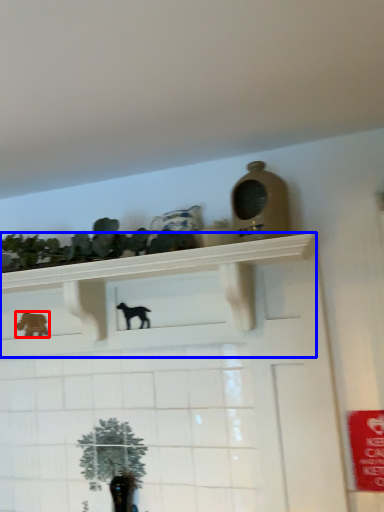
Question: Which object appears closest to the camera in this image, animal (highlighted by a red box) or shelf (highlighted by a blue box)?

Choices:
 (A) animal
 (B) shelf

Answer: (B)